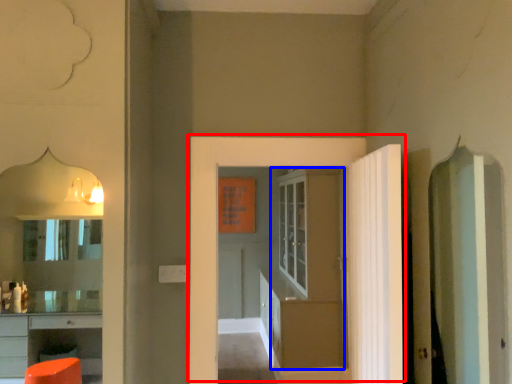
Question: Which of the following is the farthest to the observer, door (highlighted by a red box) or door (highlighted by a blue box)?

Choices:
 (A) door
 (B) door

Answer: (B)